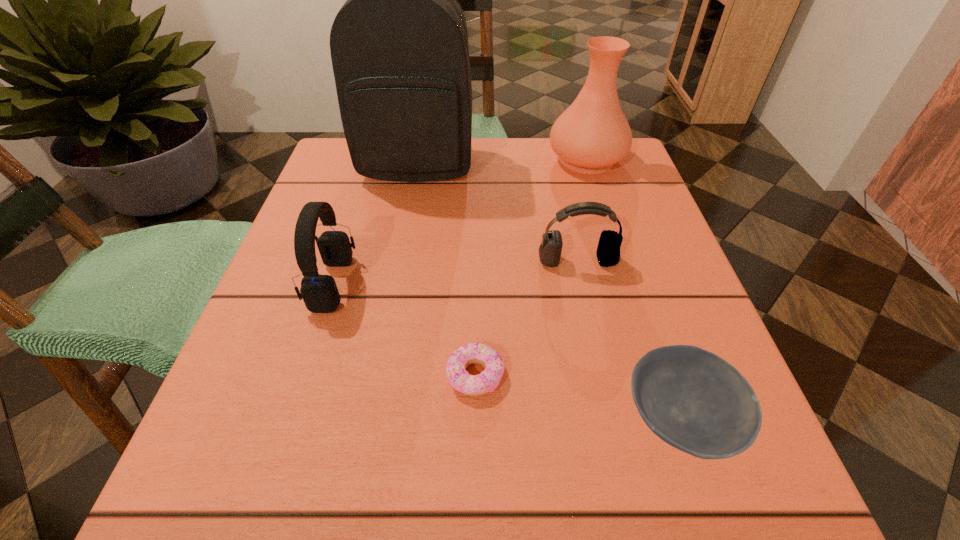
Identify the location of vacant space at the near right corner. The image size is (960, 540). (712, 488).

Where is `free space between the tallest object and the fourth shortest object`? The height and width of the screenshot is (540, 960). free space between the tallest object and the fourth shortest object is located at coordinates (375, 225).

Identify the location of blank region between the doughnut and the fifth tallest object. Image resolution: width=960 pixels, height=540 pixels. tap(577, 397).

Locate an element on the screen. empty location between the bowl and the fourth tallest object is located at coordinates (628, 341).

This screenshot has height=540, width=960. What are the coordinates of `empty location between the doughnut and the bowl` in the screenshot? It's located at (577, 397).

Find the location of a particular element. free space between the fourth shortest object and the tallest object is located at coordinates (375, 225).

Where is `free area in between the tallest object and the left headset`? free area in between the tallest object and the left headset is located at coordinates (375, 225).

Identify the location of empty location between the backpack and the taller headset. (375, 225).

Find the location of a particular element. vacant region between the right headset and the backpack is located at coordinates tap(497, 213).

This screenshot has height=540, width=960. I want to click on unoccupied area between the third shortest object and the bowl, so click(x=628, y=341).